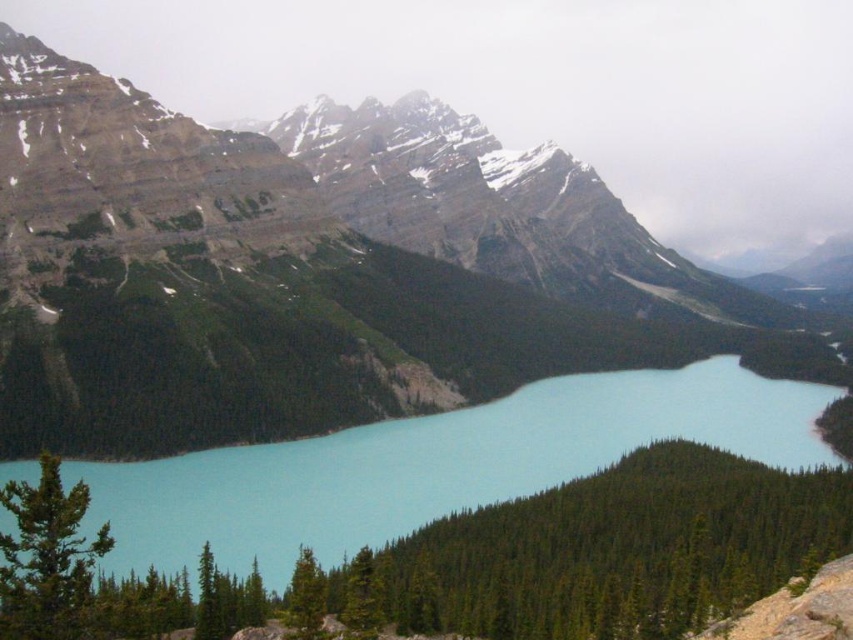
You are a hiker standing at the lakeshore and want to reach the rocky mountain at upper left. Which direction should you head from the turquoise water at center?

The rocky mountain at upper left is to the left of the turquoise water at center, so you should head to the left from the turquoise water at center to reach it.

You are planning to take a photo of the rocky mountain at upper left and the turquoise water at center. Which object should you focus on first if you want to capture both in a single frame without moving the camera?

You should focus on the rocky mountain at upper left first because it is larger than the turquoise water at center, allowing it to be the main subject while still fitting the smaller turquoise water at center into the frame.

You are a hiker planning to take a photo of the rocky mountain at upper left from the lakeside. Based on the scene, where should you position yourself to capture the mountain in the background with the lake in the foreground?

You should position yourself near the shoreline of the lake, facing the rocky mountain at upper left. This will allow the lake to be in the foreground and the mountain to be in the background of your photo.